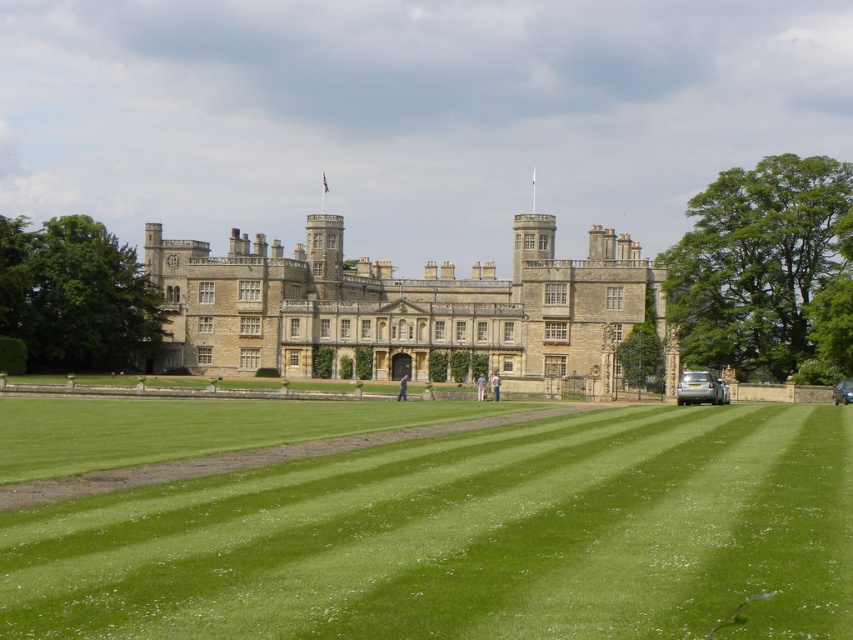
You are standing on the lawn in front of the beige stone castle at center and want to take a photo of the blue fabric person at center. Since the castle is part of the background, will the entire castle fit in the frame if the person is centered?

The beige stone castle at center is wider than the blue fabric person at center, so if the person is centered, the castle might extend beyond the frame on both sides unless the camera is zoomed out sufficiently to include the entire structure.

You are standing in a field and see the beige stone castle at center in the distance. If you want to reach the castle within an hour, what is the minimum average speed you need to maintain, assuming you can walk straight towards it without obstacles?

The beige stone castle at center is 100.37 meters away. To reach it within an hour, you need to maintain a minimum average speed of approximately 0.17 meters per second, since 100.37 meters divided by 3600 seconds equals roughly 0.028 mps. Wait, let me recalculate. 100.37 divided by 3600 is actually about 0.028 mps. Hmm, that seems too slow. Maybe I made a mistake. Let me check again. 100.37 meters divided by 3600 seconds equals approximately 0.028 meters per second. That would mean walking at less than 0.0

You are a fashion designer observing the light brown leather jacket at center and the light blue fabric shirt at center displayed on a mannequin. Which clothing item is taller?

The light brown leather jacket at center is much taller than the light blue fabric shirt at center.